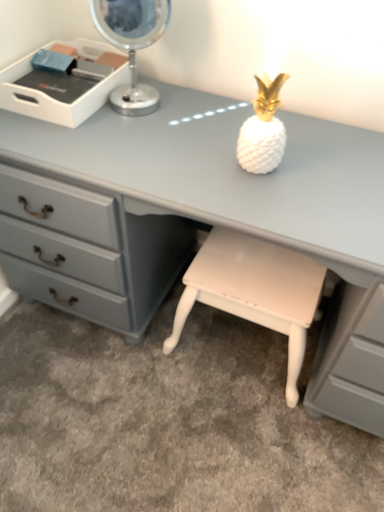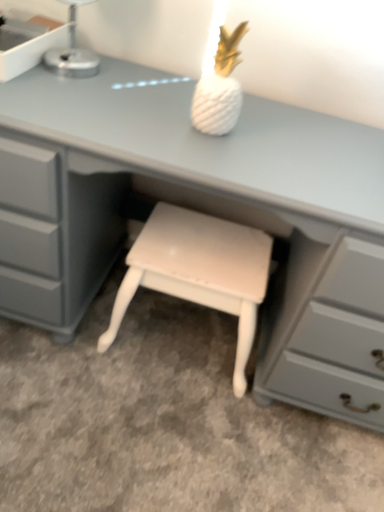
Question: Which way did the camera rotate in the video?

Choices:
 (A) rotated left
 (B) rotated right

Answer: (B)